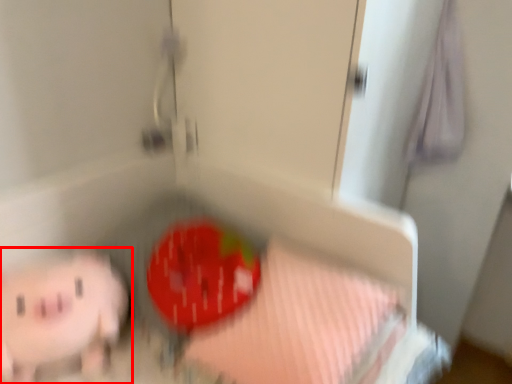
Question: From the image's perspective, what is the correct spatial relationship of toy (annotated by the red box) in relation to sheet?

Choices:
 (A) above
 (B) below

Answer: (B)